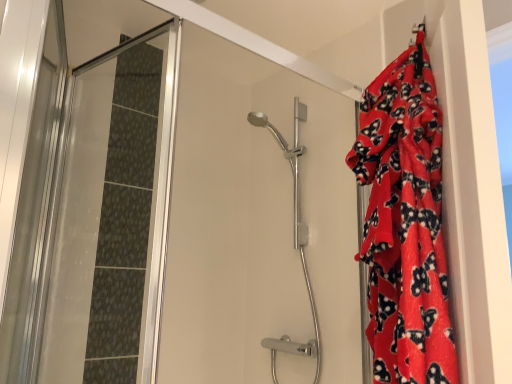
Question: Is red fleece blanket at right looking in the opposite direction of transparent glass shower door at left?

Choices:
 (A) no
 (B) yes

Answer: (A)

Question: Does red fleece blanket at right touch transparent glass shower door at left?

Choices:
 (A) yes
 (B) no

Answer: (B)

Question: From the image's perspective, is red fleece blanket at right on top of transparent glass shower door at left?

Choices:
 (A) yes
 (B) no

Answer: (A)

Question: From a real-world perspective, is red fleece blanket at right located higher than transparent glass shower door at left?

Choices:
 (A) yes
 (B) no

Answer: (A)

Question: Is red fleece blanket at right taller than transparent glass shower door at left?

Choices:
 (A) no
 (B) yes

Answer: (A)

Question: Based on their sizes in the image, would you say red fleece blanket at right is bigger or smaller than transparent glass shower door at left?

Choices:
 (A) big
 (B) small

Answer: (A)

Question: From their relative heights in the image, would you say red fleece blanket at right is taller or shorter than transparent glass shower door at left?

Choices:
 (A) tall
 (B) short

Answer: (B)

Question: Is red fleece blanket at right in front of or behind transparent glass shower door at left in the image?

Choices:
 (A) behind
 (B) front

Answer: (B)

Question: Does point (391, 84) appear closer or farther from the camera than point (125, 337)?

Choices:
 (A) closer
 (B) farther

Answer: (A)

Question: Considering the relative positions of red fleece blanket at right and polished chrome shower head at center in the image provided, is red fleece blanket at right to the left or to the right of polished chrome shower head at center?

Choices:
 (A) left
 (B) right

Answer: (B)

Question: Is red fleece blanket at right taller or shorter than polished chrome shower head at center?

Choices:
 (A) tall
 (B) short

Answer: (B)

Question: From the image's perspective, is red fleece blanket at right positioned above or below polished chrome shower head at center?

Choices:
 (A) above
 (B) below

Answer: (A)

Question: In terms of width, does red fleece blanket at right look wider or thinner when compared to polished chrome shower head at center?

Choices:
 (A) thin
 (B) wide

Answer: (A)

Question: Considering the positions of point (25, 369) and point (415, 43), is point (25, 369) closer or farther from the camera than point (415, 43)?

Choices:
 (A) closer
 (B) farther

Answer: (B)

Question: From the image's perspective, is transparent glass shower door at left located above or below red fleece blanket at right?

Choices:
 (A) above
 (B) below

Answer: (B)